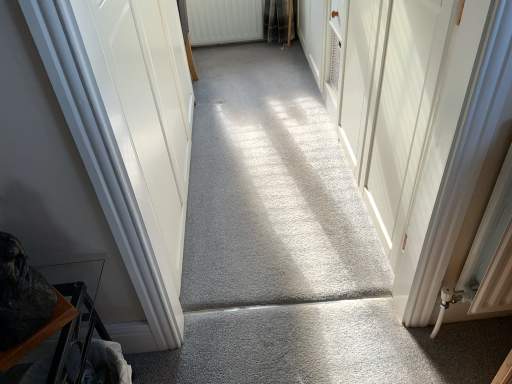
Question: Is white textured radiator at upper center at the back of gray carpet at center?

Choices:
 (A) yes
 (B) no

Answer: (B)

Question: Is gray carpet at center to the left of white textured radiator at upper center from the viewer's perspective?

Choices:
 (A) no
 (B) yes

Answer: (A)

Question: From the image's perspective, would you say gray carpet at center is positioned over white textured radiator at upper center?

Choices:
 (A) no
 (B) yes

Answer: (A)

Question: From a real-world perspective, is gray carpet at center positioned over white textured radiator at upper center based on gravity?

Choices:
 (A) no
 (B) yes

Answer: (A)

Question: Does gray carpet at center have a greater height compared to white textured radiator at upper center?

Choices:
 (A) no
 (B) yes

Answer: (A)

Question: Considering the relative sizes of gray carpet at center and white textured radiator at upper center in the image provided, is gray carpet at center wider than white textured radiator at upper center?

Choices:
 (A) yes
 (B) no

Answer: (A)

Question: Can you see white textured radiator at upper center touching gray carpet at center?

Choices:
 (A) yes
 (B) no

Answer: (B)

Question: From the image's perspective, is white textured radiator at upper center beneath gray carpet at center?

Choices:
 (A) yes
 (B) no

Answer: (B)

Question: Is the position of white textured radiator at upper center more distant than that of gray carpet at center?

Choices:
 (A) no
 (B) yes

Answer: (B)

Question: Is white textured radiator at upper center wider than gray carpet at center?

Choices:
 (A) yes
 (B) no

Answer: (B)

Question: Is white textured radiator at upper center completely or partially outside of gray carpet at center?

Choices:
 (A) yes
 (B) no

Answer: (A)

Question: Does white textured radiator at upper center appear on the left side of gray carpet at center?

Choices:
 (A) yes
 (B) no

Answer: (A)

Question: Does point (194, 21) appear closer or farther from the camera than point (260, 345)?

Choices:
 (A) closer
 (B) farther

Answer: (B)